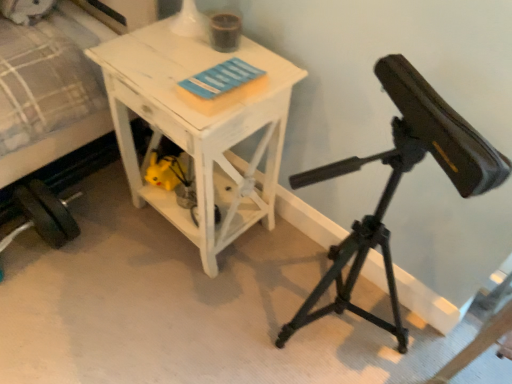
Where is `vacant space underneath black matte tripod at right (from a real-world perspective)`? The image size is (512, 384). vacant space underneath black matte tripod at right (from a real-world perspective) is located at coordinates (342, 342).